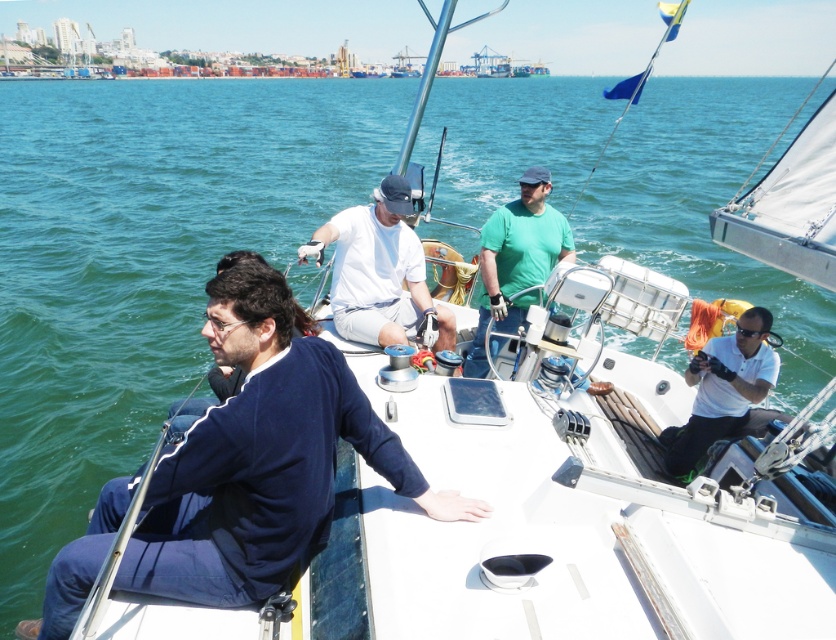
You are a photographer standing on the deck of the sailboat and want to take a photo of both the white matte shirt at center and the green matte shirt at center. The camera you have can only focus on objects within a 28 inch range. Can you capture both shirts in a single shot without moving the camera?

The distance between the white matte shirt at center and green matte shirt at center is 27.98 inches, which is just under the camera focus range of 28 inches. Therefore, you can capture both shirts in a single shot without moving the camera.